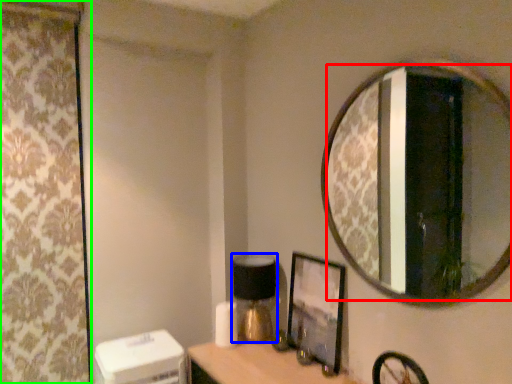
Question: Which object is the closest to the mirror (highlighted by a red box)? Choose among these: table lamp (highlighted by a blue box) or curtain (highlighted by a green box).

Choices:
 (A) table lamp
 (B) curtain

Answer: (A)